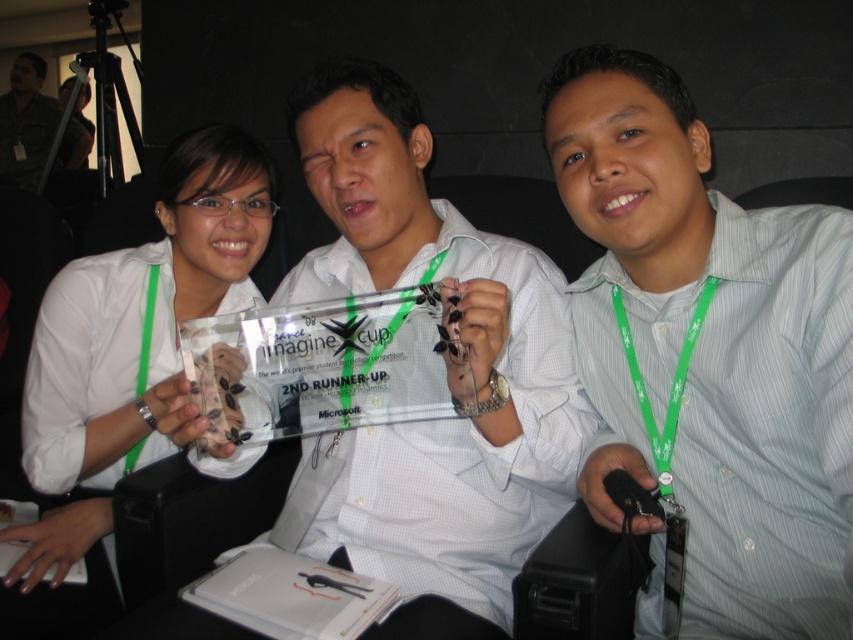
You are at a competition awards ceremony and see two trophies, the clear acrylic trophy at center and the matte white trophy at center. Which trophy is located to the right of the other?

The clear acrylic trophy at center is positioned on the right side of matte white trophy at center.

You are a photographer at the event. You need to capture a photo where the green striped shirt at center and the matte white trophy at center are both clearly visible. Given that the camera can only focus on objects wider than 20 cm, will both objects meet the focus requirement?

The green striped shirt at center is narrower than the matte white trophy at center. Since the camera requires objects wider than 20 cm to focus, only the matte white trophy at center meets the requirement. The green striped shirt at center may not be in focus if it is under 20 cm in width.